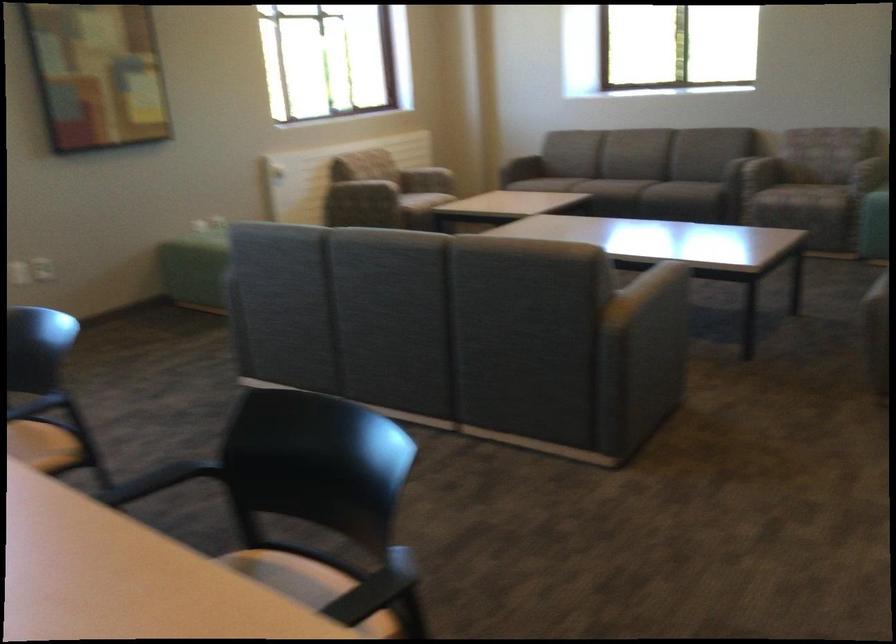
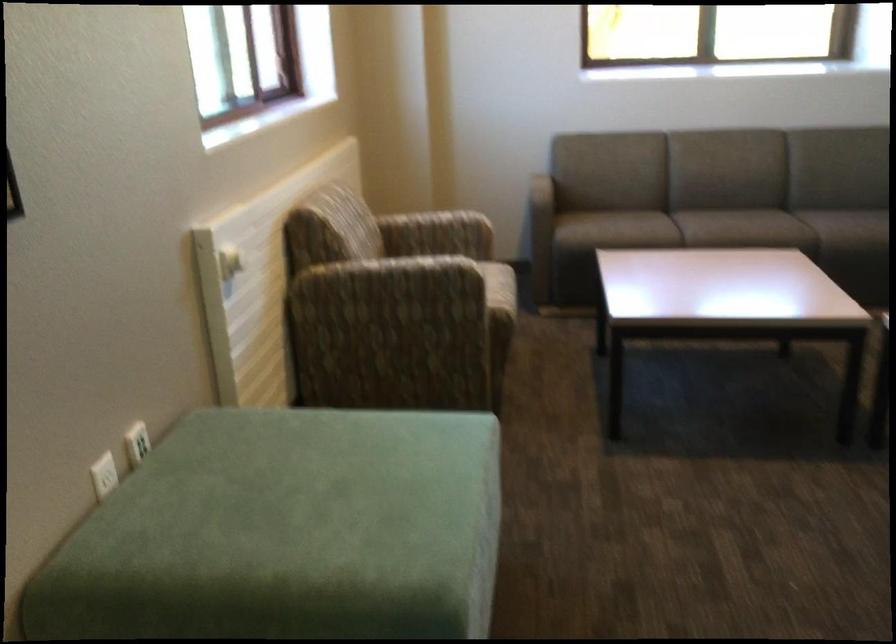
Question: I am providing you with two images of the same scene from different viewpoints. After the viewpoint changes to image2, which objects are now occluded?

Choices:
 (A) grey sofa sitting surface
 (B) white paper bin
 (C) patterned chair sitting surface
 (D) sofa armrest

Answer: (D)